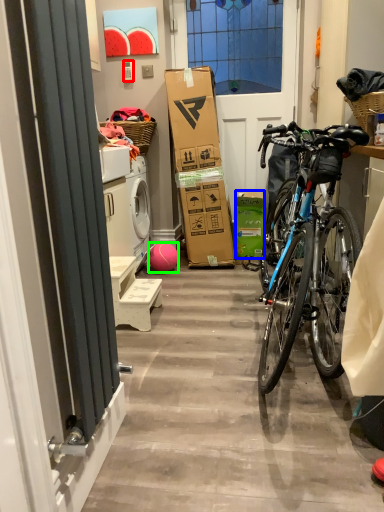
Question: Which is nearer to the power outlet (highlighted by a red box)? box (highlighted by a blue box) or ball (highlighted by a green box).

Choices:
 (A) box
 (B) ball

Answer: (B)